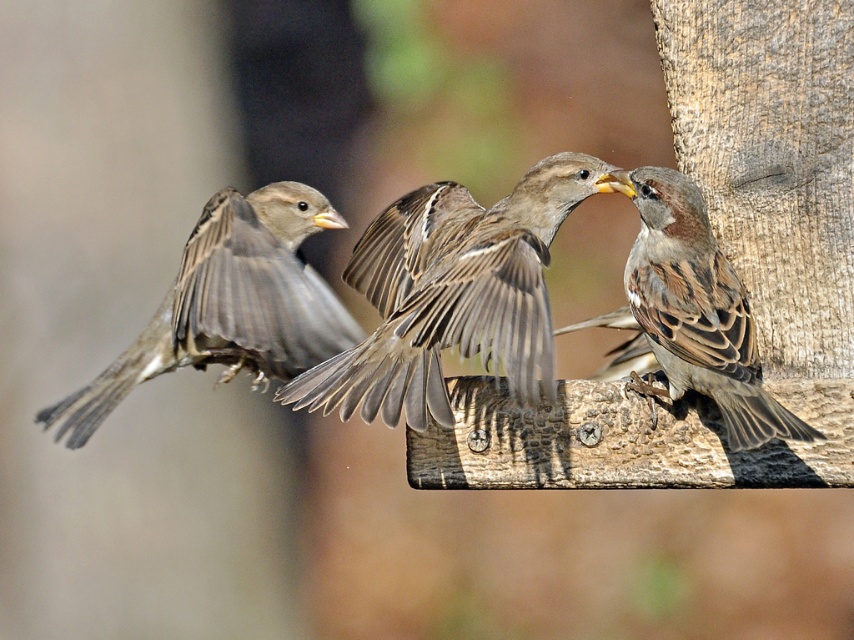
Which is behind, point (430, 371) or point (230, 198)?

The point (230, 198) is more distant.

Find the location of a particular element. brown speckled feathers at center is located at coordinates (452, 296).

This screenshot has width=854, height=640. What do you see at coordinates (452, 296) in the screenshot?
I see `brown speckled feathers at center` at bounding box center [452, 296].

Identify the location of brown speckled feathers at center. The height and width of the screenshot is (640, 854). (452, 296).

Can you confirm if brown speckled feathers at center is bigger than brown feathered sparrow at right?

Indeed, brown speckled feathers at center has a larger size compared to brown feathered sparrow at right.

Is brown speckled feathers at center to the left of brown feathered sparrow at right from the viewer's perspective?

Correct, you'll find brown speckled feathers at center to the left of brown feathered sparrow at right.

I want to click on brown speckled feathers at center, so click(x=452, y=296).

Between brown feathered sparrow at left and brown feathered sparrow at right, which one appears on the left side from the viewer's perspective?

brown feathered sparrow at left

Does point (268, 259) come farther from viewer compared to point (642, 257)?

Yes.

This screenshot has height=640, width=854. What are the coordinates of `brown feathered sparrow at left` in the screenshot? It's located at (229, 305).